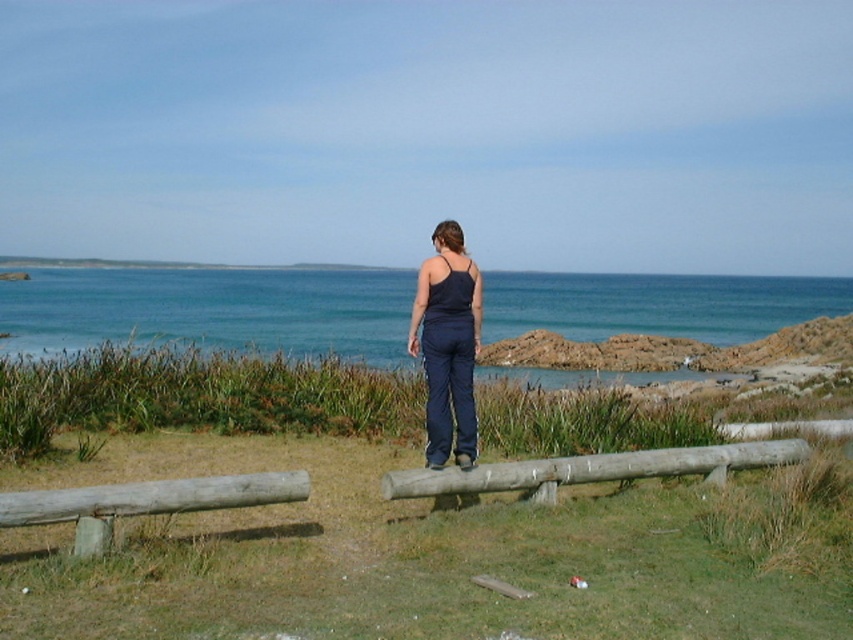
You are a photographer trying to capture the scene with the navy blue fabric pants at center and the gray weathered log at lower left. Which object takes up more area in the photo?

The gray weathered log at lower left takes up more area in the photo because the navy blue fabric pants at center occupies less space than gray weathered log at lower left.

You are standing at the shoreline in the coastal scene and want to place a small piece of litter you found into your pocket. The litter is located at point A. The smooth wooden log at center is at point B. If you move from point A to point B, will you be moving towards the ocean or away from it?

The smooth wooden log at center is at point B located at coordinate (590, 468). Since the person is facing the ocean while standing between the logs, moving from point A to point B would mean moving away from the ocean towards the log. Therefore, you would be moving away from the ocean.

You are a hiker who wants to sit on the logs. Which log, the smooth wooden log at center or the gray weathered log at lower left, is closer to the ground?

The smooth wooden log at center is positioned under gray weathered log at lower left, so the smooth wooden log at center is closer to the ground.